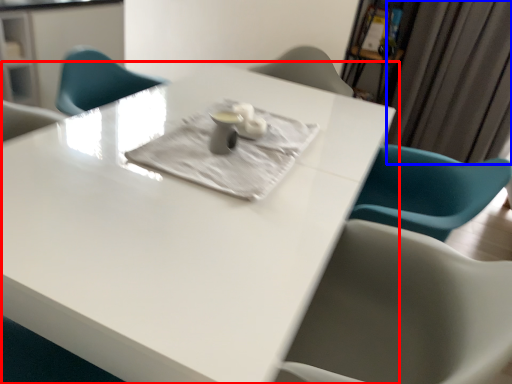
Question: Which of the following is the closest to the observer, table (highlighted by a red box) or curtain (highlighted by a blue box)?

Choices:
 (A) table
 (B) curtain

Answer: (A)